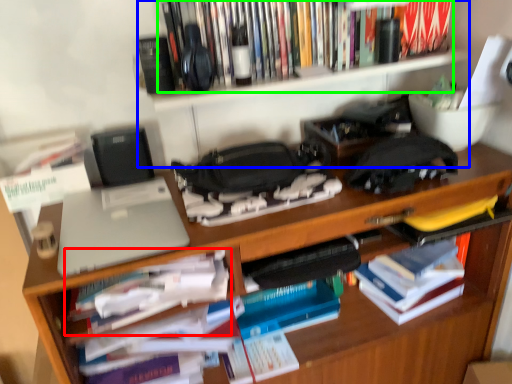
Question: Which object is the closest to the book (highlighted by a red box)? Choose among these: bookshelf (highlighted by a blue box) or book (highlighted by a green box).

Choices:
 (A) bookshelf
 (B) book

Answer: (A)